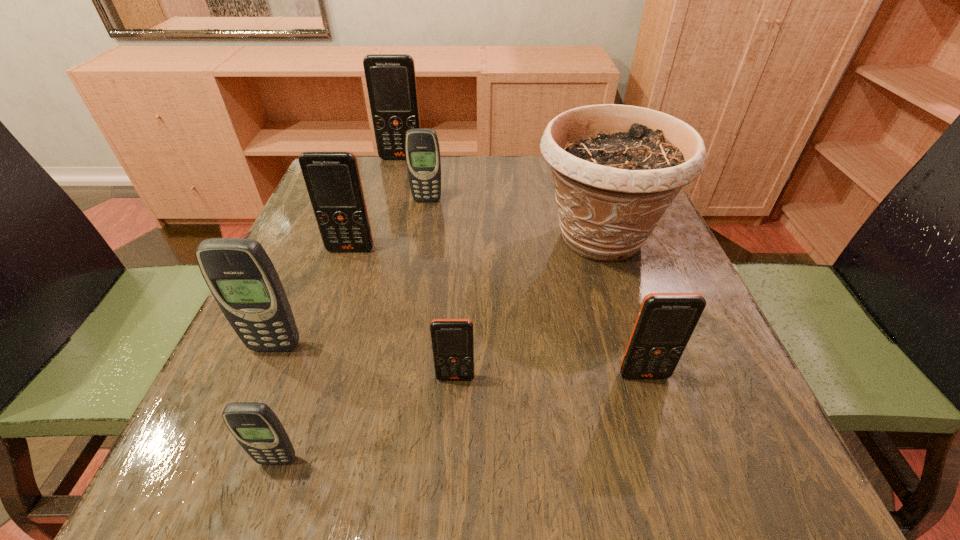
Image resolution: width=960 pixels, height=540 pixels. What are the coordinates of `vacant space in between the smallest gray cellular telephone and the fifth farthest object` in the screenshot? It's located at click(x=276, y=403).

Point out which object is positioned as the sixth nearest to the nearest cellular telephone. Please provide its 2D coordinates. Your answer should be formatted as a tuple, i.e. [(x, y)], where the tuple contains the x and y coordinates of a point satisfying the conditions above.

[(422, 150)]

Find the location of `object that is the fifth closest to the sixth cellular telephone from left to right`. object that is the fifth closest to the sixth cellular telephone from left to right is located at coordinates (332, 178).

Locate an element on the screen. the closest cellular telephone to the flowerpot is located at coordinates (665, 322).

Choose which cellular telephone is the third nearest neighbor to the fourth nearest cellular telephone. Please provide its 2D coordinates. Your answer should be formatted as a tuple, i.e. [(x, y)], where the tuple contains the x and y coordinates of a point satisfying the conditions above.

[(332, 178)]

I want to click on orange cellular telephone that is the second nearest to the third smallest orange cellular telephone, so click(x=391, y=80).

Identify which orange cellular telephone is located as the fourth nearest to the flowerpot. Please provide its 2D coordinates. Your answer should be formatted as a tuple, i.e. [(x, y)], where the tuple contains the x and y coordinates of a point satisfying the conditions above.

[(332, 178)]

Identify the location of gray cellular telephone that is the second closest to the farthest gray cellular telephone. The image size is (960, 540). (255, 426).

The image size is (960, 540). I want to click on gray cellular telephone that stands as the closest to the third biggest orange cellular telephone, so click(255, 426).

Identify the location of free space that satisfies the following two spatial constraints: 1. on the screen of the farthest orange cellular telephone; 2. on the right side of the flowerpot. The height and width of the screenshot is (540, 960). (380, 238).